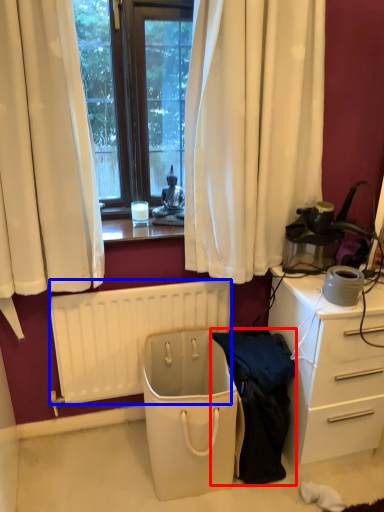
Question: Which point is closer to the camera, clothing (highlighted by a red box) or radiator (highlighted by a blue box)?

Choices:
 (A) clothing
 (B) radiator

Answer: (A)